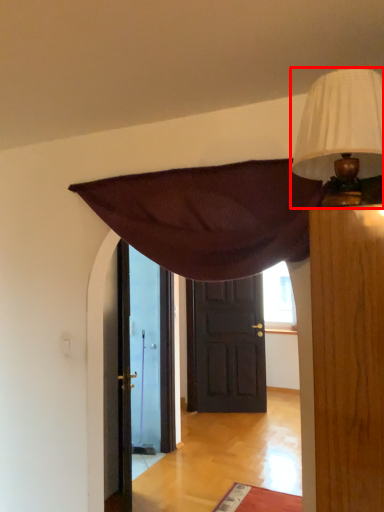
Question: From the image, what is the correct spatial relationship of lamp (annotated by the red box) in relation to door?

Choices:
 (A) left
 (B) right

Answer: (A)